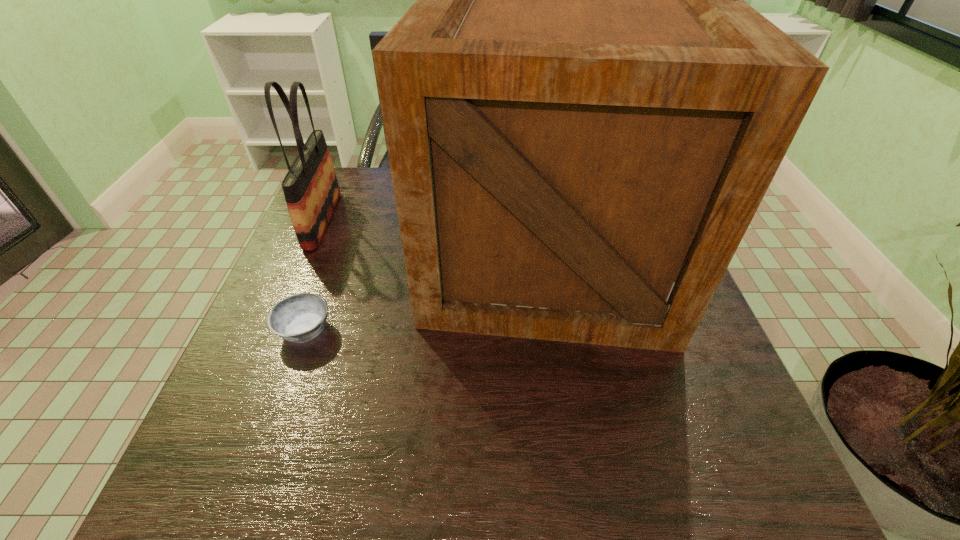
Find the location of a particular element. The image size is (960, 540). empty location between the ashtray and the shopping bag is located at coordinates (314, 275).

Find the location of a particular element. This screenshot has height=540, width=960. free space that is in between the second shortest object and the shortest object is located at coordinates (314, 275).

The image size is (960, 540). Identify the location of unoccupied area between the second shortest object and the ashtray. (314, 275).

Identify which object is the second closest to the tallest object. Please provide its 2D coordinates. Your answer should be formatted as a tuple, i.e. [(x, y)], where the tuple contains the x and y coordinates of a point satisfying the conditions above.

[(311, 190)]

The width and height of the screenshot is (960, 540). I want to click on object that is the second nearest to the shortest object, so click(311, 190).

Where is `free space in the image that satisfies the following two spatial constraints: 1. on the front-facing side of the second tallest object; 2. on the back side of the ashtray`? free space in the image that satisfies the following two spatial constraints: 1. on the front-facing side of the second tallest object; 2. on the back side of the ashtray is located at coordinates (276, 330).

Where is `free space that satisfies the following two spatial constraints: 1. on the front-facing side of the second tallest object; 2. on the right side of the shortest object`? This screenshot has height=540, width=960. free space that satisfies the following two spatial constraints: 1. on the front-facing side of the second tallest object; 2. on the right side of the shortest object is located at coordinates (276, 330).

Find the location of a particular element. This screenshot has height=540, width=960. free space that satisfies the following two spatial constraints: 1. on the front-facing side of the second shortest object; 2. on the left side of the tallest object is located at coordinates (308, 253).

Where is `vacant space that satisfies the following two spatial constraints: 1. on the front-facing side of the ashtray; 2. on the left side of the shopping bag`? The image size is (960, 540). vacant space that satisfies the following two spatial constraints: 1. on the front-facing side of the ashtray; 2. on the left side of the shopping bag is located at coordinates (276, 330).

You are a GUI agent. You are given a task and a screenshot of the screen. Output one action in this format:
    pyautogui.click(x=<x>, y=<y>)
    Task: Click on the vacant space that satisfies the following two spatial constraints: 1. on the front-facing side of the rightmost object; 2. on the left side of the shopping bag
    
    Given the screenshot: What is the action you would take?
    pyautogui.click(x=308, y=253)